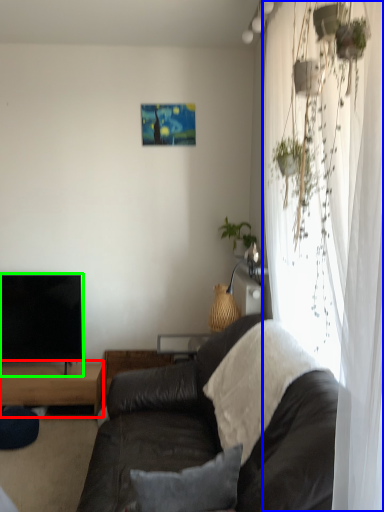
Question: Based on their relative distances, which object is nearer to table (highlighted by a red box)? Choose from curtain (highlighted by a blue box) and television (highlighted by a green box).

Choices:
 (A) curtain
 (B) television

Answer: (B)